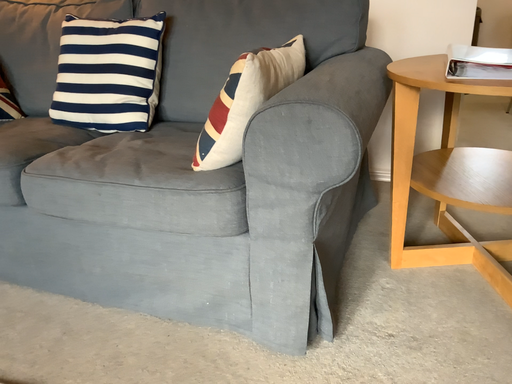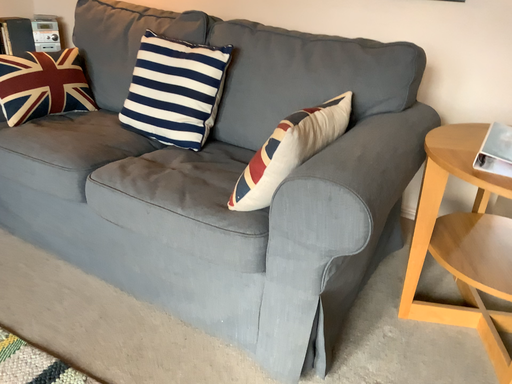
Question: Which way did the camera rotate in the video?

Choices:
 (A) rotated left
 (B) rotated right

Answer: (A)